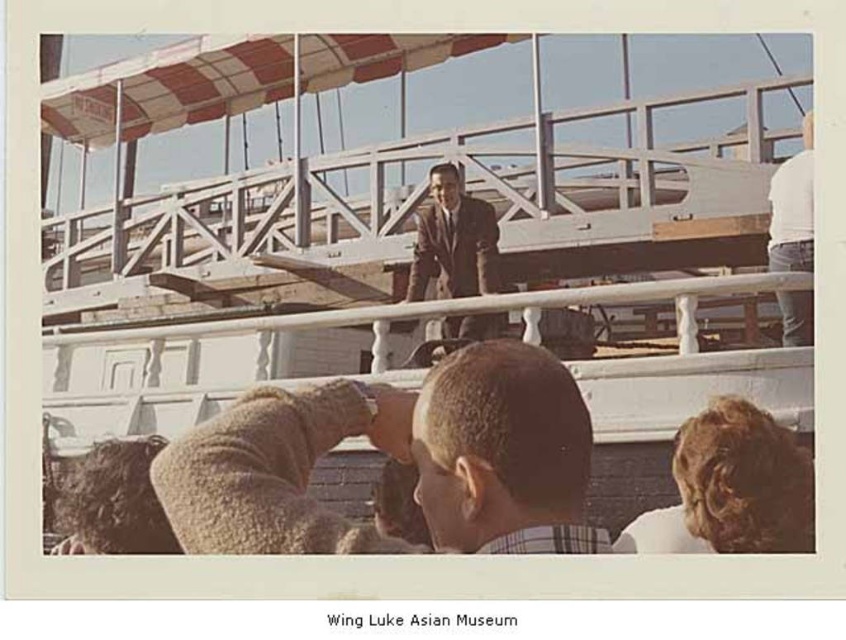
Which is behind, point (495, 548) or point (794, 296)?

Positioned behind is point (794, 296).

Between point (525, 451) and point (805, 323), which one is positioned behind?

Positioned behind is point (805, 323).

At what (x,y) coordinates should I click in order to perform the action: click on light brown hair at center. Please return your answer as a coordinate pair (x, y). Looking at the image, I should click on (503, 452).

Is point (503, 404) more distant than point (471, 216)?

No, it is in front of (471, 216).

Is light brown hair at center taller than matte brown suit at center?

No, light brown hair at center is not taller than matte brown suit at center.

Where is `light brown hair at center`? light brown hair at center is located at coordinates (503, 452).

Who is shorter, matte brown suit at center or white cotton shirt at upper right?

Standing shorter between the two is matte brown suit at center.

Which is more to the left, matte brown suit at center or white cotton shirt at upper right?

matte brown suit at center is more to the left.

Does point (459, 276) come farther from viewer compared to point (790, 195)?

That is True.

Where is `matte brown suit at center`? matte brown suit at center is located at coordinates (454, 241).